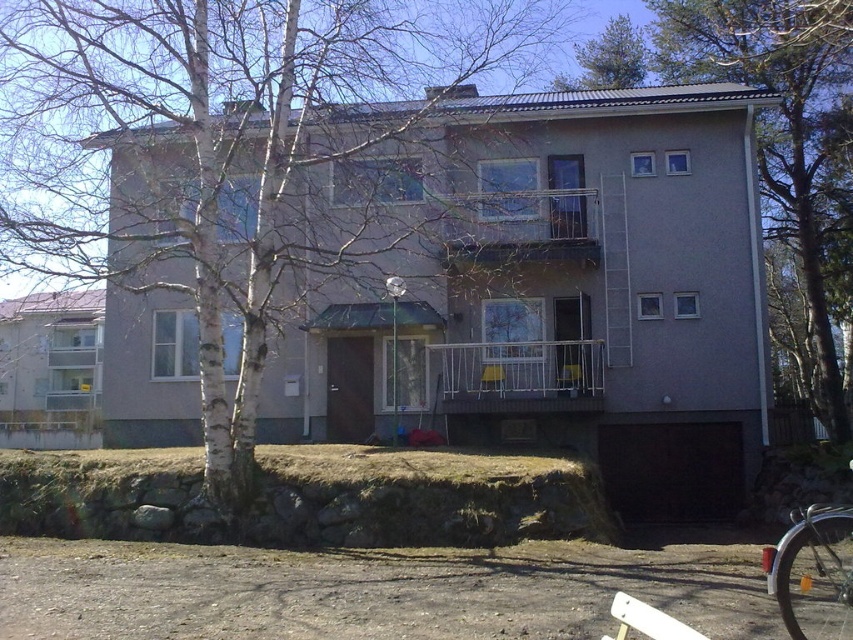
Is green leafy tree at upper right further to the viewer compared to green leafy tree at upper center?

No.

Is point (796, 156) closer to viewer compared to point (636, 40)?

Yes.

Is point (720, 16) positioned before point (601, 83)?

That is True.

I want to click on green leafy tree at upper right, so click(x=782, y=132).

Between white bark tree at center and green leafy tree at upper center, which one is positioned lower?

white bark tree at center

Who is higher up, white bark tree at center or green leafy tree at upper center?

green leafy tree at upper center

Is point (0, 204) more distant than point (604, 26)?

No.

Find the location of a particular element. The height and width of the screenshot is (640, 853). white bark tree at center is located at coordinates (223, 148).

Can you confirm if white bark tree at center is taller than silver metallic bicycle at lower right?

Yes.

Who is taller, white bark tree at center or silver metallic bicycle at lower right?

Standing taller between the two is white bark tree at center.

Describe the element at coordinates (223, 148) in the screenshot. I see `white bark tree at center` at that location.

You are a GUI agent. You are given a task and a screenshot of the screen. Output one action in this format:
    pyautogui.click(x=<x>, y=<y>)
    Task: Click on the white bark tree at center
    The image size is (853, 640).
    Given the screenshot: What is the action you would take?
    pyautogui.click(x=223, y=148)